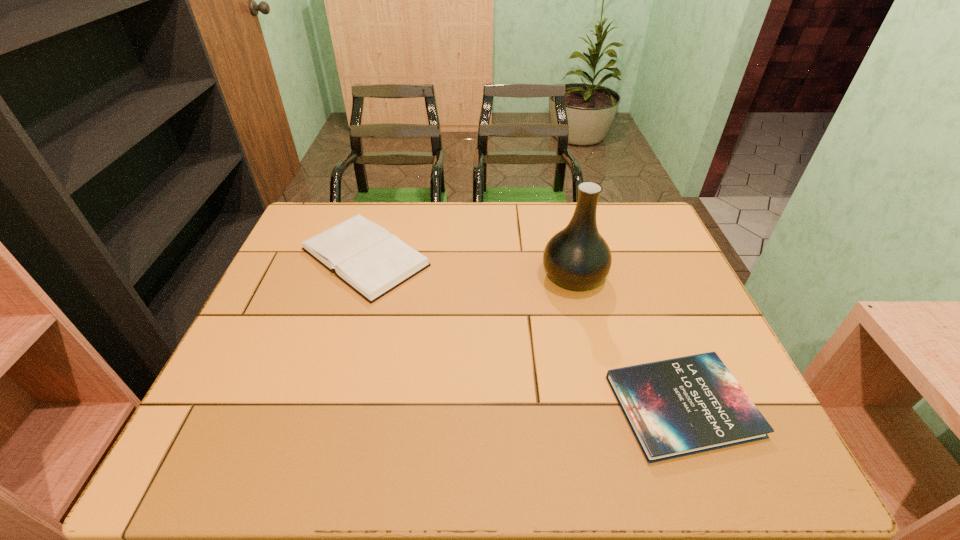
Where is `free space between the farther hardback book and the nearest object`? Image resolution: width=960 pixels, height=540 pixels. free space between the farther hardback book and the nearest object is located at coordinates (524, 332).

The height and width of the screenshot is (540, 960). Identify the location of free spot between the left hardback book and the tallest object. (469, 267).

I want to click on unoccupied position between the vase and the shorter hardback book, so click(x=628, y=341).

Locate an element on the screen. free spot between the nearest object and the farther hardback book is located at coordinates (524, 332).

Find the location of a particular element. free spot between the left hardback book and the tallest object is located at coordinates (469, 267).

Locate an element on the screen. This screenshot has width=960, height=540. vacant space in between the second tallest object and the vase is located at coordinates (469, 267).

Locate an element on the screen. blank region between the taller hardback book and the nearest object is located at coordinates (524, 332).

This screenshot has height=540, width=960. Identify the location of vacant space in between the vase and the farther hardback book. (469, 267).

Image resolution: width=960 pixels, height=540 pixels. Identify the location of free space between the left hardback book and the shorter hardback book. (524, 332).

Locate an element on the screen. The image size is (960, 540). empty space between the right hardback book and the leftmost object is located at coordinates (524, 332).